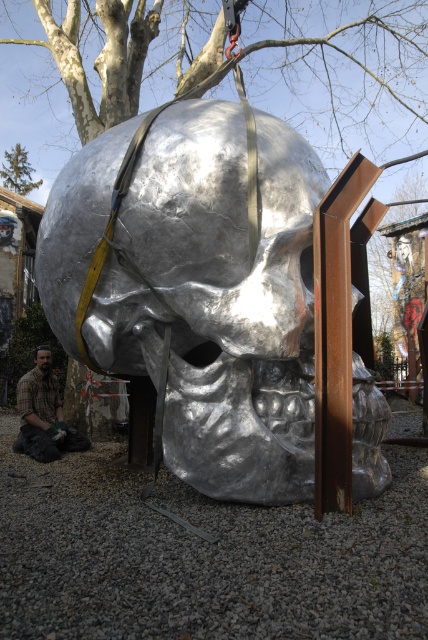
You are an art installer working on positioning the metallic skull at center and the brown hair at center. Based on the scene, which object is positioned higher relative to the other?

The metallic skull at center is located above the brown hair at center, so it is positioned higher.

You are an art installer standing in front of the sculpture. You need to adjust the yellow straps attached to the crane hook at the top. Which part of the sculpture, the metallic skull at center or the brown hair at center, should you focus on first if you want to work on the part nearest to you?

The metallic skull at center is closer to the viewer than the brown hair at center, so you should focus on the metallic skull at center first.